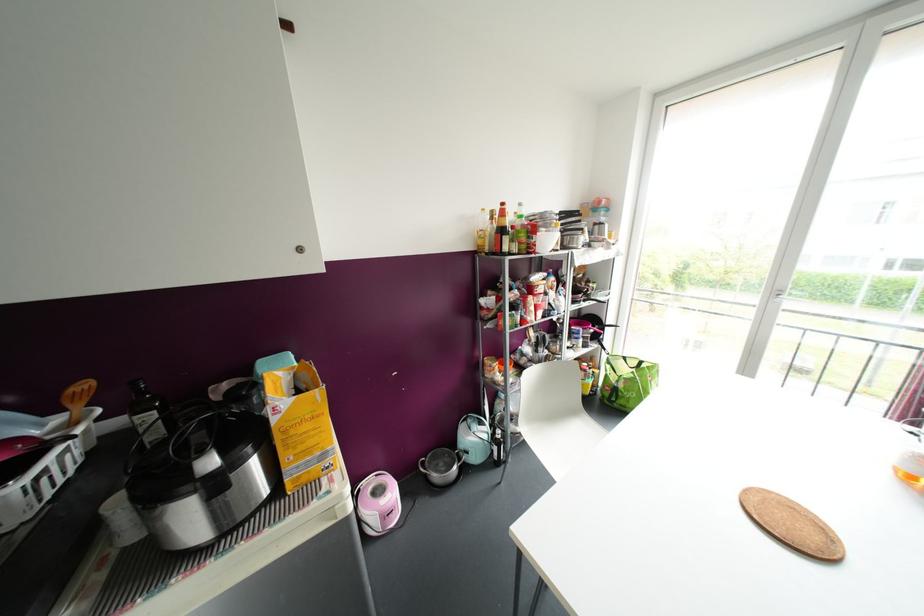
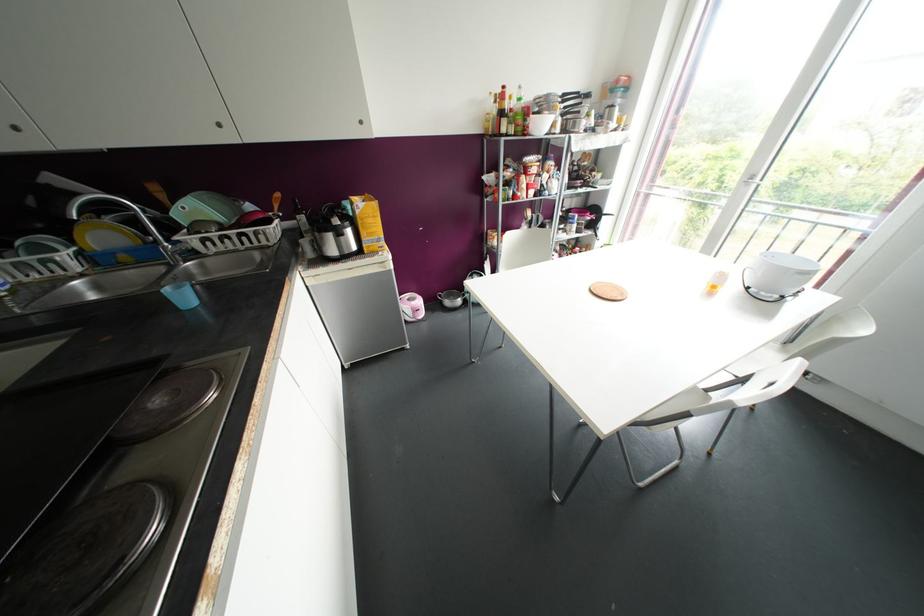
Locate, in the second image, the point that corresponds to the point at 305,427 in the first image.

(370, 220)